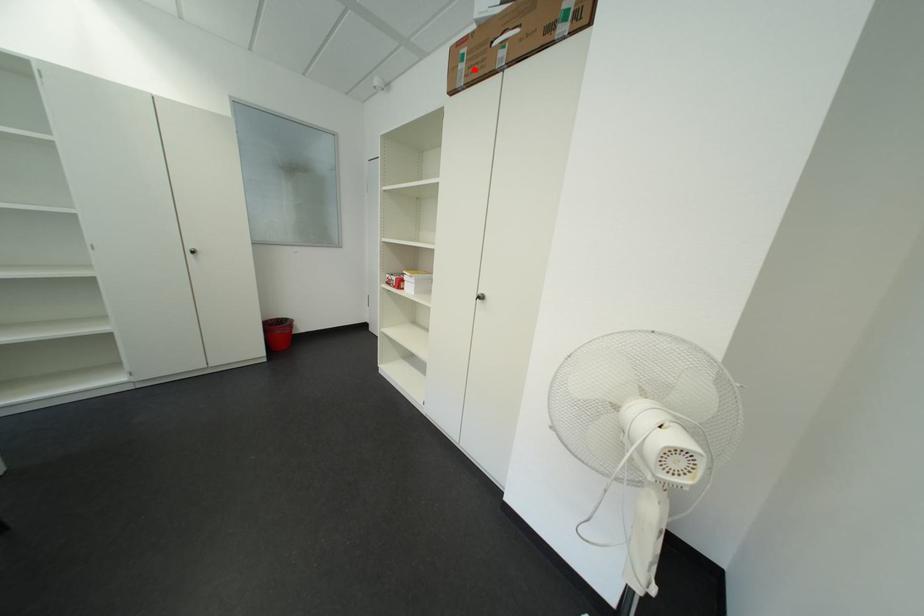
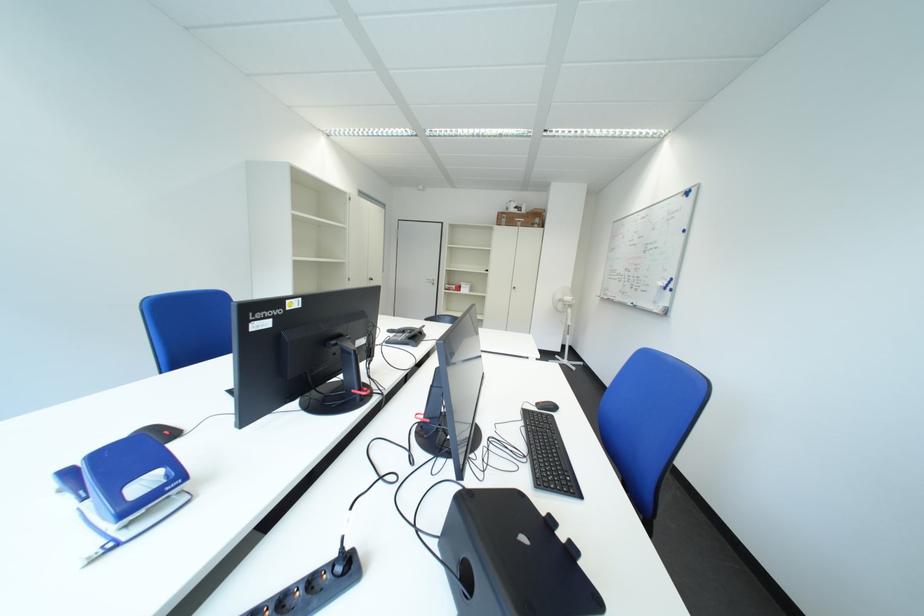
In the second image, find the point that corresponds to the highlighted location in the first image.

(517, 223)